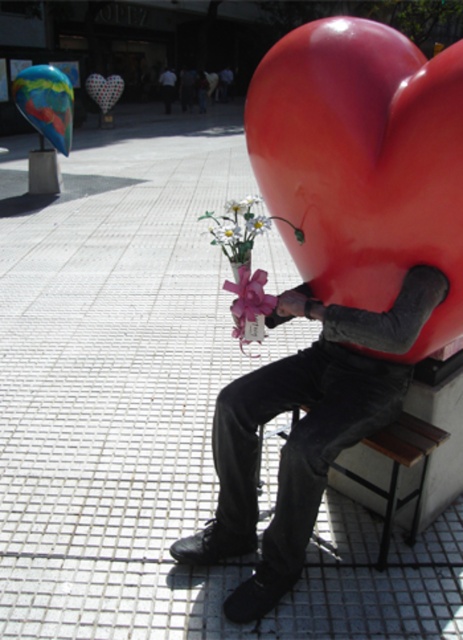
You are a photographer standing at the edge of the plaza. You want to take a photo of the white paper flower at center without the matte black pants at center blocking the view. Is this possible given their positions?

The matte black pants at center is in front of the white paper flower at center, so it will block the view. You cannot take a photo of the white paper flower at center without the matte black pants at center blocking the view.

You are standing at the center of the plaza and want to place a new bench exactly 1 meter to the left of the glossy plastic heart at right. Given that the plaza is a flat, open space with no obstacles, can you determine the coordinates where the new bench should be placed?

The glossy plastic heart at right is located at coordinates (363, 163). To place the new bench 1 meter to the left, subtract 1 meter from the x coordinate. The new coordinates would be 0.256 minus 1 meter equals negative 0.744, but since coordinates can not be negative, the bench cannot be placed there. Alternatively, if the plaza has boundaries, the bench would be placed at the edge closest to the desired position.

You are standing at the center of the plaza and see a point marked at coordinates (x=363, y=163). What object is located at that point?

The point at (x=363, y=163) indicates the glossy plastic heart at right.